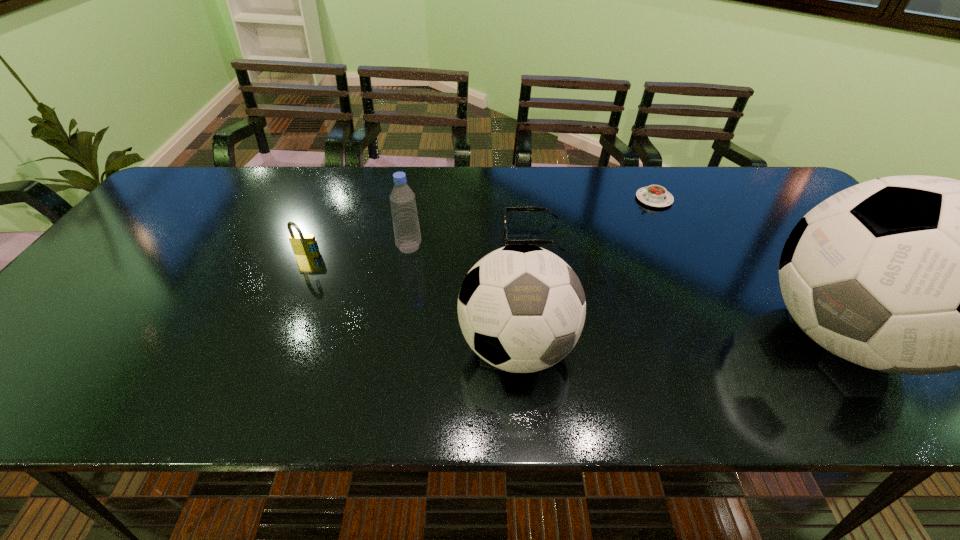
Where is `the shorter soccer ball`? This screenshot has width=960, height=540. the shorter soccer ball is located at coordinates (521, 308).

Where is `the farthest object`? This screenshot has width=960, height=540. the farthest object is located at coordinates (654, 195).

You are a GUI agent. You are given a task and a screenshot of the screen. Output one action in this format:
    pyautogui.click(x=<x>, y=<y>)
    Task: Click on the shortest object
    This screenshot has width=960, height=540.
    Given the screenshot: What is the action you would take?
    pyautogui.click(x=654, y=195)

Locate an element on the screen. The image size is (960, 540). bottle is located at coordinates (407, 234).

Where is `the leftmost object`? the leftmost object is located at coordinates (302, 244).

Image resolution: width=960 pixels, height=540 pixels. What are the coordinates of `the third shortest object` in the screenshot? It's located at (302, 244).

This screenshot has height=540, width=960. What are the coordinates of `the second shortest object` in the screenshot? It's located at (523, 209).

Locate an element on the screen. This screenshot has height=540, width=960. vacant space located on the left of the fifth object from left to right is located at coordinates (548, 199).

What are the coordinates of `vacant space located on the front of the fifth object from right to left` in the screenshot? It's located at (399, 306).

Find the location of `vacant space located on the side with the combination dials of the third shortest object`. vacant space located on the side with the combination dials of the third shortest object is located at coordinates (271, 340).